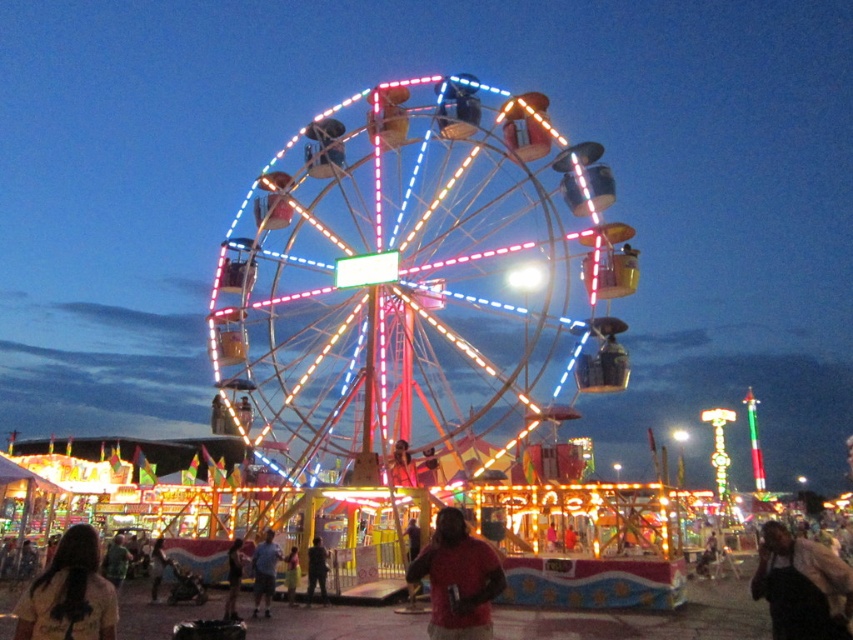
You are a photographer at the fairground and want to capture both the blue denim shorts at center and the smooth blue shirt at center in a single frame. Which of the two items would appear smaller in the photo?

The blue denim shorts at center would appear smaller in the photo because it is smaller than the smooth blue shirt at center.

You are a photographer trying to capture a candid shot of the blue denim shorts at center and the brown fabric shirt at lower left. Given their sizes, which one should you zoom in on more to ensure both are clearly visible in the frame?

The blue denim shorts at center is smaller in size compared to the brown fabric shirt at lower left. To ensure both are clearly visible, you should zoom in more on the blue denim shorts at center so its details are not lost while keeping the larger brown fabric shirt at lower left within the frame.